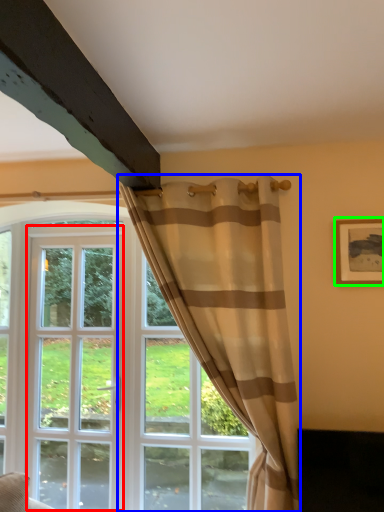
Question: Estimate the real-world distances between objects in this image. Which object is farther from screen door (highlighted by a red box), curtain (highlighted by a blue box) or picture frame (highlighted by a green box)?

Choices:
 (A) curtain
 (B) picture frame

Answer: (B)